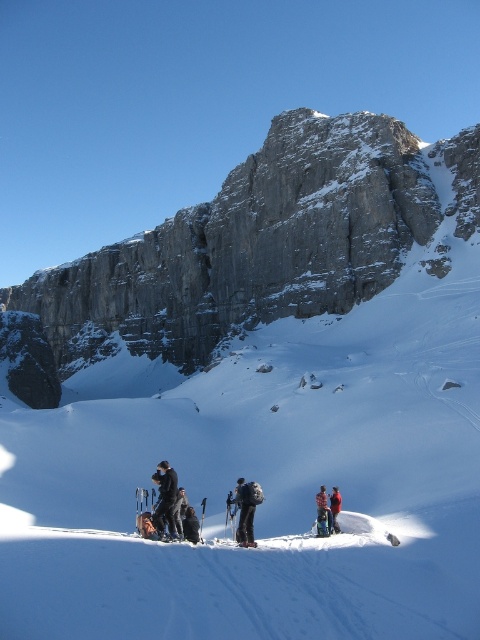
Does point (247, 490) come in front of point (324, 506)?

That is False.

Is black ski suit at center further to the viewer compared to plaid wool jacket at lower center?

That is False.

Is point (256, 483) positioned behind point (317, 512)?

Yes, it is.

You are a GUI agent. You are given a task and a screenshot of the screen. Output one action in this format:
    pyautogui.click(x=<x>, y=<y>)
    Task: Click on the black ski suit at center
    Image resolution: width=480 pixels, height=640 pixels.
    Given the screenshot: What is the action you would take?
    pyautogui.click(x=247, y=509)

Between black fabric jacket at lower center and black ski suit at center, which one is positioned lower?

black ski suit at center is below.

Can you confirm if black fabric jacket at lower center is taller than black ski suit at center?

Correct, black fabric jacket at lower center is much taller as black ski suit at center.

Is point (172, 508) farther from camera compared to point (248, 529)?

Yes, point (172, 508) is behind point (248, 529).

You are a GUI agent. You are given a task and a screenshot of the screen. Output one action in this format:
    pyautogui.click(x=<x>, y=<y>)
    Task: Click on the black fabric jacket at lower center
    Image resolution: width=480 pixels, height=640 pixels.
    Given the screenshot: What is the action you would take?
    pyautogui.click(x=166, y=497)

Does black ski suit at center come in front of plaid wool jacket at center?

Yes.

Which is more to the left, black ski suit at center or plaid wool jacket at center?

Positioned to the left is black ski suit at center.

Find the location of `black ski suit at center`. black ski suit at center is located at coordinates [x=247, y=509].